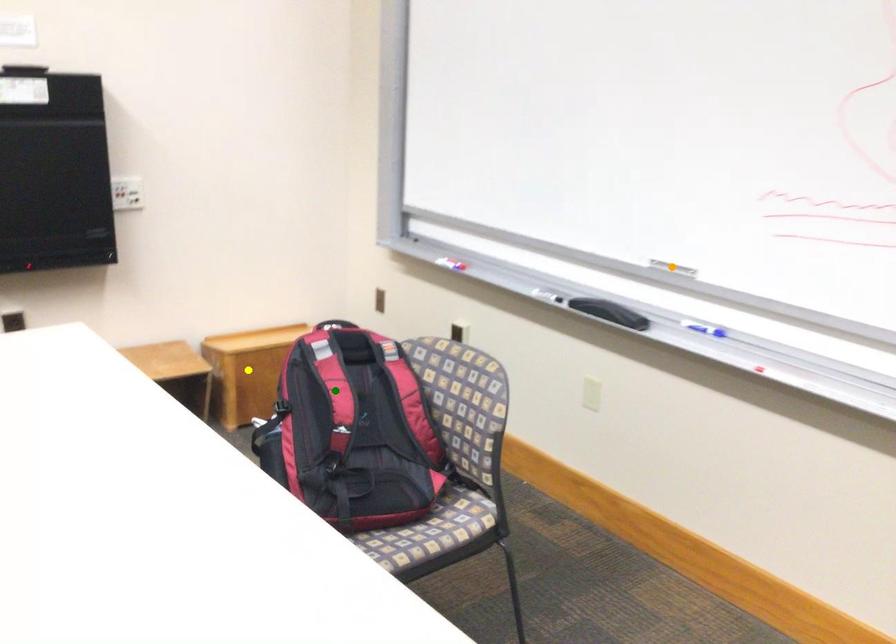
Order these from nearest to farthest:
yellow point
green point
orange point

yellow point → orange point → green point